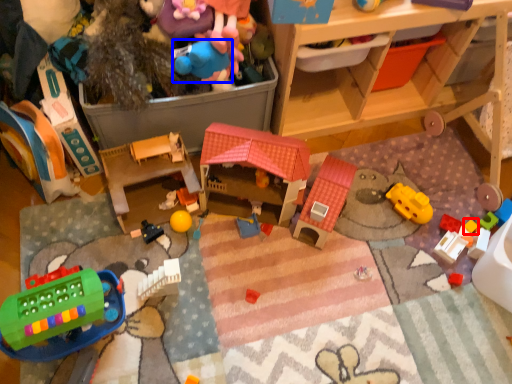
Question: Among these objects, which one is nearest to the camera, toy (highlighted by a red box) or toy (highlighted by a blue box)?

Choices:
 (A) toy
 (B) toy

Answer: (B)